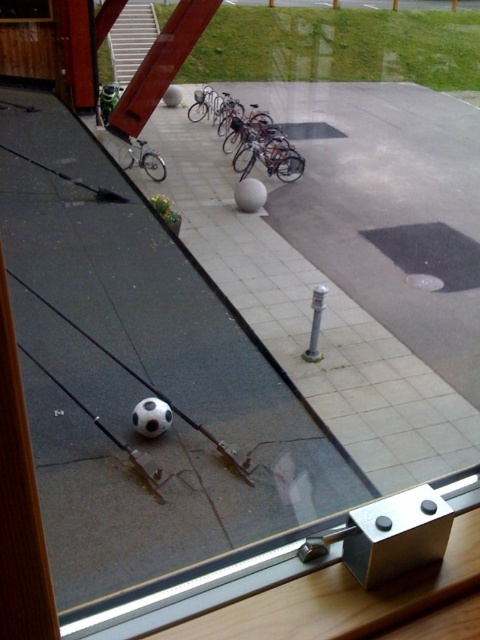
Question: Can you confirm if shiny metallic bicycles at center is wider than silver metallic bicycle at center?

Choices:
 (A) yes
 (B) no

Answer: (A)

Question: Is transparent glass door at center smaller than silver metallic bicycle at center?

Choices:
 (A) yes
 (B) no

Answer: (B)

Question: Does transparent glass window at upper left appear under silver metallic bicycle at center?

Choices:
 (A) yes
 (B) no

Answer: (B)

Question: Which point is closer to the camera taking this photo?

Choices:
 (A) (248, 161)
 (B) (36, 388)
 (C) (160, 161)
 (D) (36, 19)

Answer: (B)

Question: Which point appears farthest from the camera in this image?

Choices:
 (A) (12, 17)
 (B) (273, 148)
 (C) (94, 177)
 (D) (148, 152)

Answer: (B)

Question: Estimate the real-world distances between objects in this image. Which object is farther from the silver metallic bicycle at center?

Choices:
 (A) shiny metallic bicycles at center
 (B) transparent glass door at center

Answer: (B)